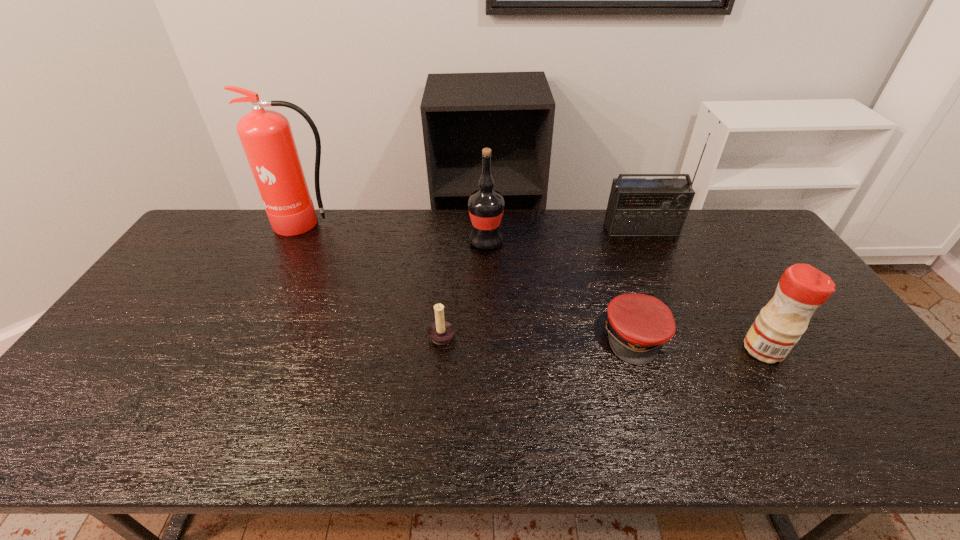
Locate an element on the screen. the tallest object is located at coordinates (266, 136).

Locate an element on the screen. This screenshot has height=540, width=960. the leftmost object is located at coordinates (266, 136).

Identify the location of radio receiver. The height and width of the screenshot is (540, 960). (637, 206).

Where is `wine bottle`? This screenshot has height=540, width=960. wine bottle is located at coordinates (486, 206).

Locate an element on the screen. condiment is located at coordinates (802, 288).

Where is `candle holder`? The image size is (960, 540). candle holder is located at coordinates [x=440, y=332].

What are the coordinates of `the second shortest object` in the screenshot? It's located at (440, 332).

Where is `cap`? This screenshot has height=540, width=960. cap is located at coordinates (639, 324).

Locate an element on the screen. free spot located 0.300m towards the nozzle of the leftmost object is located at coordinates (271, 298).

Find the location of a particular element. This screenshot has height=540, width=960. vacant space located on the front panel of the radio receiver is located at coordinates (663, 278).